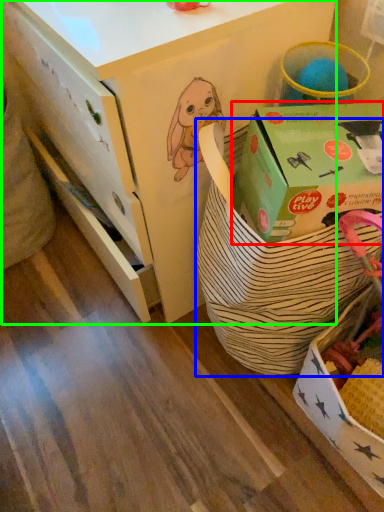
Question: Which object is the farthest from box (highlighted by a red box)? Choose among these: gift basket (highlighted by a blue box) or desk (highlighted by a green box).

Choices:
 (A) gift basket
 (B) desk

Answer: (B)